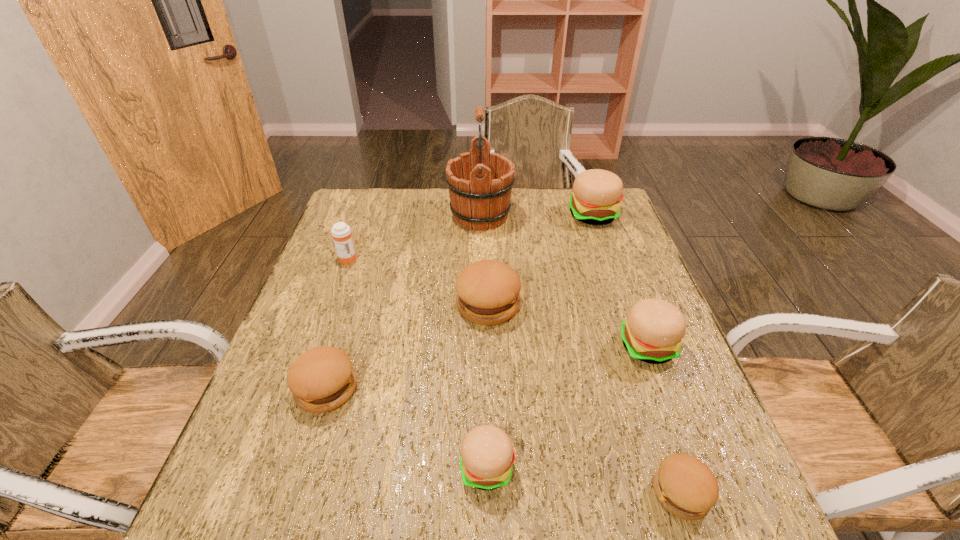
I want to click on vacant space located on the back of the leftmost brown hamburger, so click(x=342, y=340).

Locate an element on the screen. vacant space located 0.340m on the back of the nearest beige hamburger is located at coordinates (485, 315).

Locate an element on the screen. free space located 0.060m on the left of the rightmost brown hamburger is located at coordinates (619, 492).

Identify the location of wine bucket present at the far edge. (480, 183).

Locate an element on the screen. The height and width of the screenshot is (540, 960). hamburger positioned at the far edge is located at coordinates (597, 193).

At what (x,y) coordinates should I click in order to perform the action: click on object that is at the near edge. Please return your answer as a coordinate pair (x, y). This screenshot has width=960, height=540. Looking at the image, I should click on (686, 487).

Where is `medicine at the left edge`? The image size is (960, 540). medicine at the left edge is located at coordinates (341, 233).

You are a GUI agent. You are given a task and a screenshot of the screen. Output one action in this format:
    pyautogui.click(x=<x>, y=<y>)
    Task: Click on the hamburger that is at the left edge
    
    Given the screenshot: What is the action you would take?
    pyautogui.click(x=321, y=379)

Locate an element on the screen. Image resolution: width=960 pixels, height=540 pixels. object that is at the far right corner is located at coordinates (597, 193).

This screenshot has height=540, width=960. Identify the location of object at the near right corner. (686, 487).